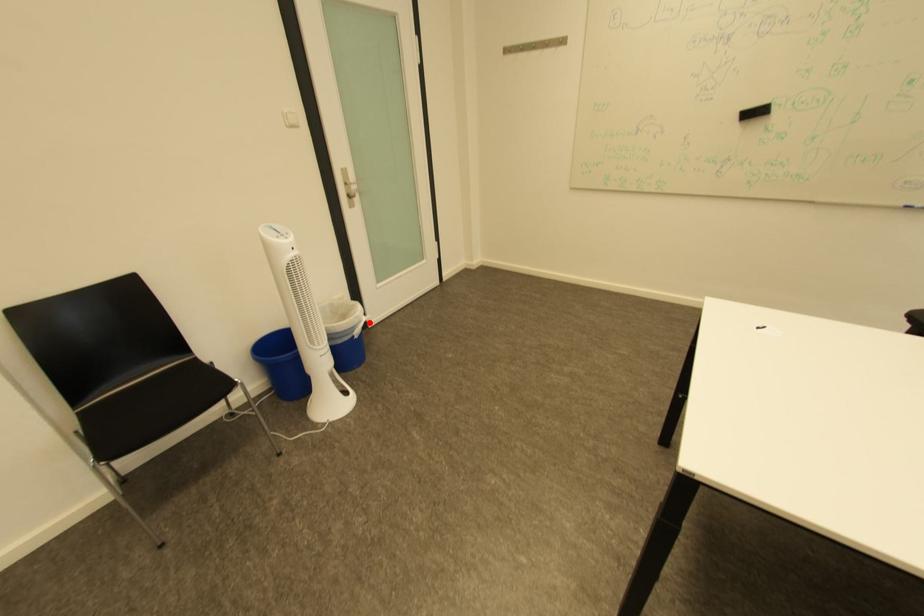
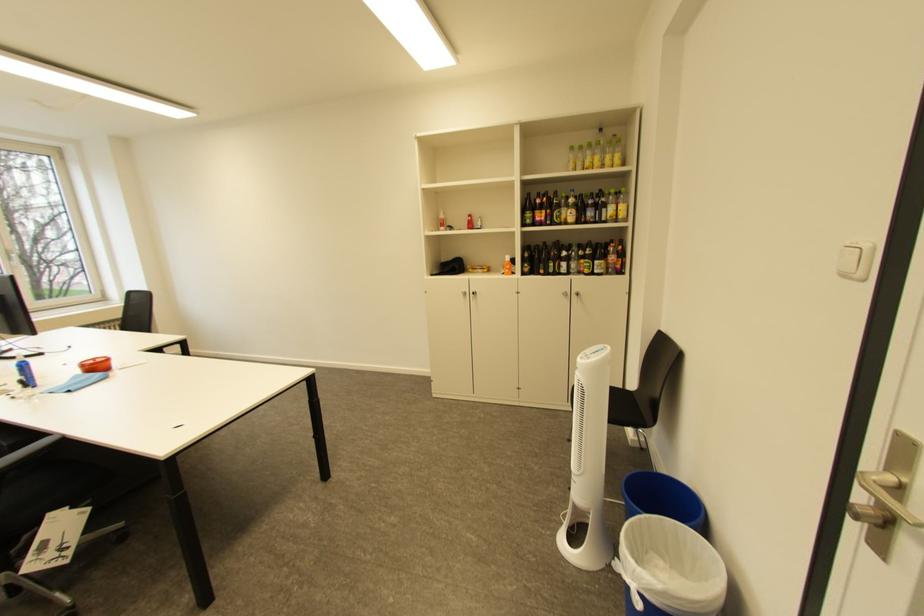
Question: I am providing you with two images of the same scene from different viewpoints. Given a red point in image1, look at the same physical point in image2. Is it:

Choices:
 (A) Closer to the viewpoint
 (B) Farther from the viewpoint

Answer: (B)